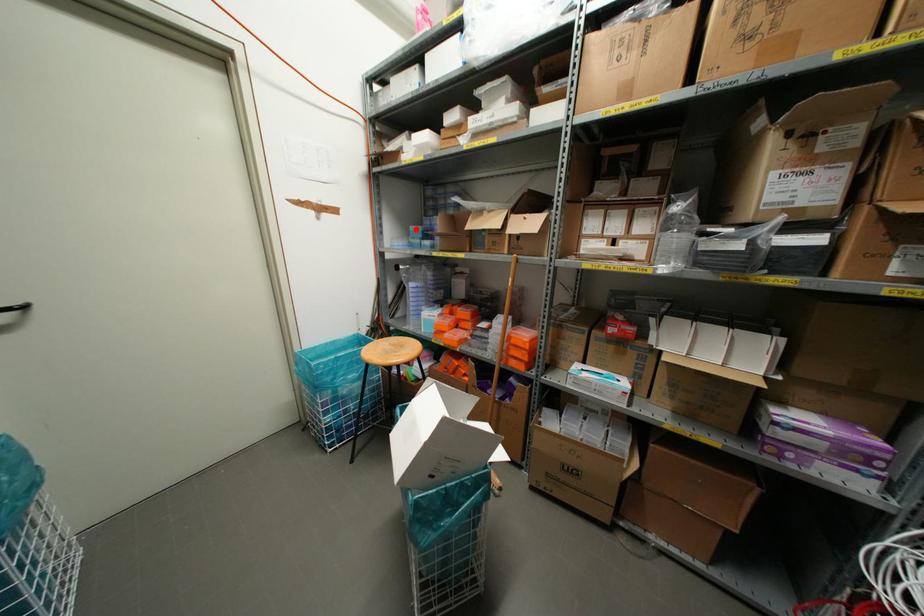
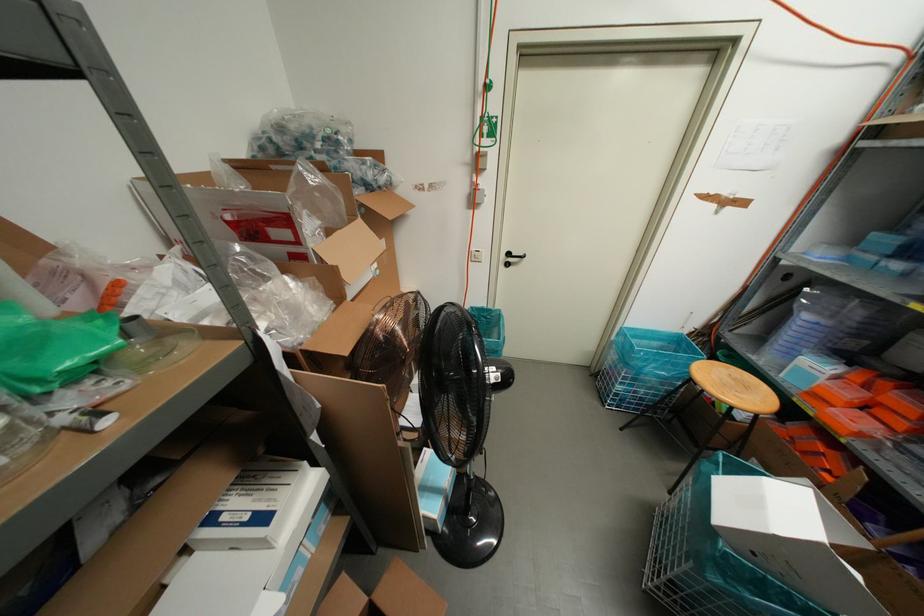
Where in the second image is the point corresponding to the highlighted location from the first image?

(885, 240)